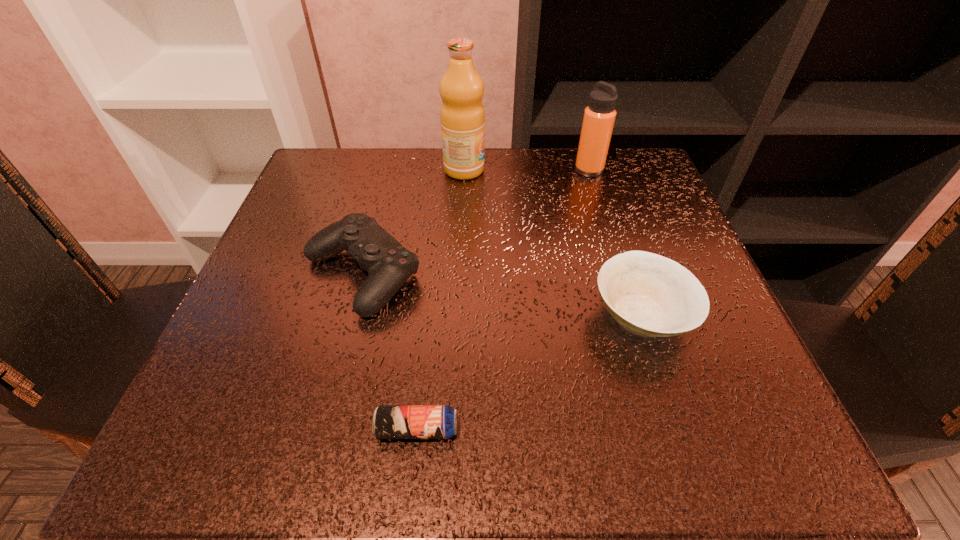
The height and width of the screenshot is (540, 960). I want to click on empty location between the bowl and the thermos bottle, so click(x=615, y=243).

I want to click on free area in between the tallest object and the bowl, so click(x=553, y=243).

Where is `the second closest object to the fourth shortest object`? The width and height of the screenshot is (960, 540). the second closest object to the fourth shortest object is located at coordinates (648, 294).

Identify which object is located as the third nearest to the bowl. Please provide its 2D coordinates. Your answer should be formatted as a tuple, i.e. [(x, y)], where the tuple contains the x and y coordinates of a point satisfying the conditions above.

[(599, 117)]

The height and width of the screenshot is (540, 960). I want to click on free space in the image that satisfies the following two spatial constraints: 1. on the back side of the bowl; 2. on the left side of the beer can, so click(429, 316).

Locate an element on the screen. This screenshot has height=540, width=960. free point that satisfies the following two spatial constraints: 1. on the front label of the fruit juice; 2. on the back side of the second tallest object is located at coordinates click(464, 170).

I want to click on blank area in the image that satisfies the following two spatial constraints: 1. on the back side of the fourth shortest object; 2. on the front label of the fruit juice, so click(588, 170).

Where is `vacant area in the image that satisfies the following two spatial constraints: 1. on the back side of the fourth shortest object; 2. on the right side of the control`? This screenshot has height=540, width=960. vacant area in the image that satisfies the following two spatial constraints: 1. on the back side of the fourth shortest object; 2. on the right side of the control is located at coordinates coord(389,170).